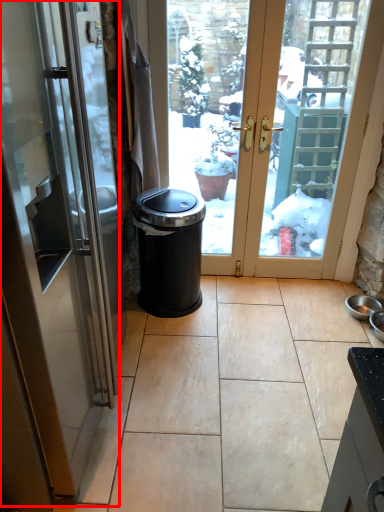
Question: From the image's perspective, where is door (annotated by the red box) located relative to waste container?

Choices:
 (A) below
 (B) above

Answer: (B)